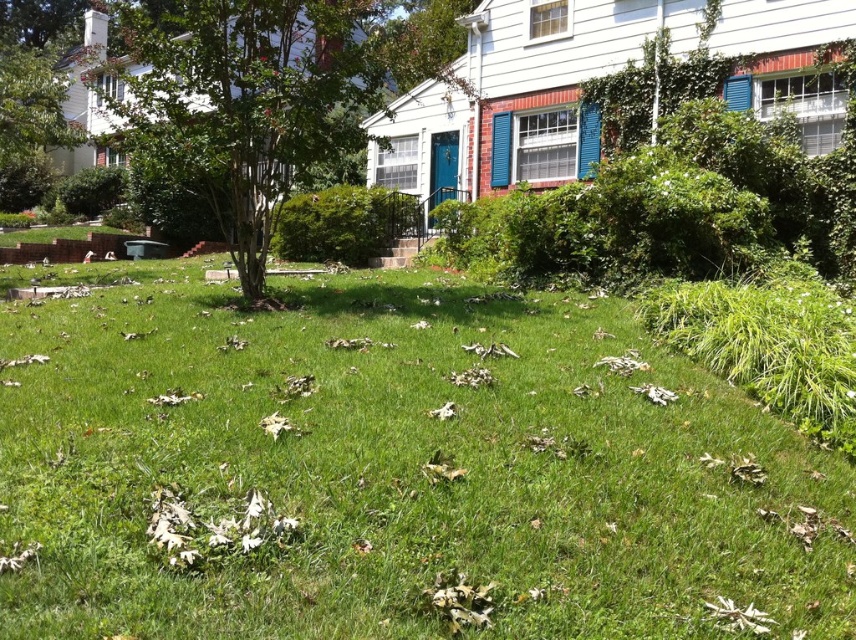
The image size is (856, 640). Describe the element at coordinates (397, 467) in the screenshot. I see `green grass at center` at that location.

Is point (111, 483) behind point (212, 161)?

No, (111, 483) is in front of (212, 161).

Who is more distant from viewer, (x=377, y=426) or (x=137, y=22)?

The point (x=137, y=22) is more distant.

Identify the location of green grass at center. (397, 467).